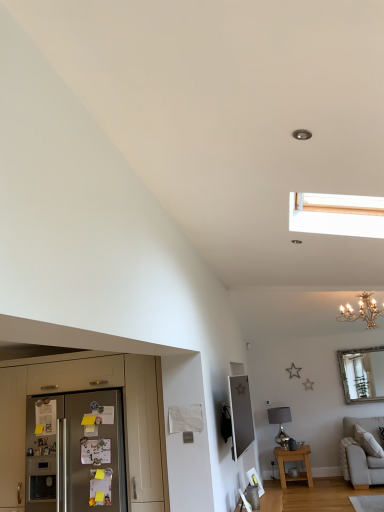
What do you see at coordinates (361, 454) in the screenshot? I see `light gray fabric couch at lower right` at bounding box center [361, 454].

What is the approximate height of stainless steel refrigerator at lower left?

1.58 meters.

Measure the distance between point (x=150, y=463) and camera.

3.73 meters.

Where is `silver metallic mirror at upper right`? The height and width of the screenshot is (512, 384). silver metallic mirror at upper right is located at coordinates (362, 374).

Locate an element on the screen. The image size is (384, 512). satin silver refrigerator at lower left is located at coordinates (75, 454).

In order to face satin silver refrigerator at lower left, should I rotate leftwards or rightwards?

Rotate left and turn 13.868 degrees.

You are a GUI agent. You are given a task and a screenshot of the screen. Output one action in this format:
    pyautogui.click(x=<x>, y=<y>)
    Task: Click on the beech wood side table at lower right
    Image resolution: width=384 pixels, height=512 pixels.
    Given the screenshot: What is the action you would take?
    pyautogui.click(x=294, y=462)

This screenshot has height=512, width=384. I want to click on light gray fabric couch at lower right, so click(361, 454).

From a real-world perspective, is satin silver lamp at lower right positioned above or below light gray fabric couch at lower right?

satin silver lamp at lower right is situated higher than light gray fabric couch at lower right in the real world.

In terms of size, does satin silver lamp at lower right appear bigger or smaller than light gray fabric couch at lower right?

Considering their sizes, satin silver lamp at lower right takes up less space than light gray fabric couch at lower right.

Can you see satin silver lamp at lower right touching light gray fabric couch at lower right?

No, satin silver lamp at lower right is not with light gray fabric couch at lower right.

Consider the image. Is satin silver lamp at lower right looking in the opposite direction of light gray fabric couch at lower right?

That's not correct — satin silver lamp at lower right is not looking away from light gray fabric couch at lower right.

Based on the photo, from the image's perspective, is satin silver lamp at lower right on top of beech wood side table at lower right?

Yes, from the image's perspective, satin silver lamp at lower right is on top of beech wood side table at lower right.

Is satin silver lamp at lower right facing towards beech wood side table at lower right?

No, satin silver lamp at lower right is not turned towards beech wood side table at lower right.

Considering the relative sizes of satin silver lamp at lower right and beech wood side table at lower right in the image provided, is satin silver lamp at lower right shorter than beech wood side table at lower right?

In fact, satin silver lamp at lower right may be taller than beech wood side table at lower right.

Which of these two, satin silver lamp at lower right or beech wood side table at lower right, is smaller?

satin silver lamp at lower right.

I want to click on cabinetry that is under the silver metallic mirror at upper right (from a real-world perspective), so click(88, 389).

From the image's perspective, is silver metallic mirror at upper right located above or below stainless steel refrigerator at lower left?

silver metallic mirror at upper right is situated lower than stainless steel refrigerator at lower left in the image.

Is silver metallic mirror at upper right wider or thinner than stainless steel refrigerator at lower left?

In the image, silver metallic mirror at upper right appears to be more narrow than stainless steel refrigerator at lower left.

Between silver metallic mirror at upper right and stainless steel refrigerator at lower left, which one appears on the left side from the viewer's perspective?

stainless steel refrigerator at lower left is more to the left.

From a real-world perspective, is light gray fabric couch at lower right below satin silver refrigerator at lower left?

Correct, in the physical world, light gray fabric couch at lower right is lower than satin silver refrigerator at lower left.

Where is `fridge above the light gray fabric couch at lower right (from a real-world perspective)`? The height and width of the screenshot is (512, 384). fridge above the light gray fabric couch at lower right (from a real-world perspective) is located at coordinates (75, 454).

Is light gray fabric couch at lower right oriented away from satin silver refrigerator at lower left?

No.

From the image's perspective, is light gray fabric couch at lower right positioned above or below satin silver refrigerator at lower left?

light gray fabric couch at lower right is below satin silver refrigerator at lower left.

Is the position of gold metallic chandelier at upper right less distant than that of stainless steel refrigerator at lower left?

No.

From the image's perspective, does gold metallic chandelier at upper right appear higher than stainless steel refrigerator at lower left?

Indeed, from the image's perspective, gold metallic chandelier at upper right is shown above stainless steel refrigerator at lower left.

Can you confirm if gold metallic chandelier at upper right is taller than stainless steel refrigerator at lower left?

Incorrect, the height of gold metallic chandelier at upper right is not larger of that of stainless steel refrigerator at lower left.

Can you tell me how much gold metallic chandelier at upper right and stainless steel refrigerator at lower left differ in facing direction?

The angle between the facing direction of gold metallic chandelier at upper right and the facing direction of stainless steel refrigerator at lower left is 0.787 degrees.

Is light gray fabric couch at lower right surrounded by satin silver refrigerator at lower left?

Actually, light gray fabric couch at lower right is outside satin silver refrigerator at lower left.

Relative to light gray fabric couch at lower right, is satin silver refrigerator at lower left in front or behind?

satin silver refrigerator at lower left is positioned closer to the viewer than light gray fabric couch at lower right.

From the image's perspective, which one is positioned lower, satin silver refrigerator at lower left or light gray fabric couch at lower right?

light gray fabric couch at lower right.

Does point (62, 399) come behind point (364, 426)?

No, it is in front of (364, 426).

Would you say light gray fabric couch at lower right contains stainless steel refrigerator at lower left?

No, stainless steel refrigerator at lower left is not inside light gray fabric couch at lower right.

Is light gray fabric couch at lower right wider than stainless steel refrigerator at lower left?

Correct, the width of light gray fabric couch at lower right exceeds that of stainless steel refrigerator at lower left.

This screenshot has width=384, height=512. Identify the location of lamp behind the light gray fabric couch at lower right. (x=280, y=423).

Image resolution: width=384 pixels, height=512 pixels. Find the location of `table below the satin silver lamp at lower right (from a real-world perspective)`. table below the satin silver lamp at lower right (from a real-world perspective) is located at coordinates (294, 462).

From the image, which object appears to be farther from stainless steel refrigerator at lower left, silver metallic mirror at upper right or gold metallic chandelier at upper right?

silver metallic mirror at upper right.

When comparing their distances from gold metallic chandelier at upper right, does beech wood side table at lower right or satin silver lamp at lower right seem further?

beech wood side table at lower right is further to gold metallic chandelier at upper right.

Considering their positions, is stainless steel refrigerator at lower left positioned closer to light gray fabric couch at lower right than satin silver lamp at lower right?

satin silver lamp at lower right lies closer to light gray fabric couch at lower right than the other object.

Looking at the image, which one is located further to gold metallic chandelier at upper right, silver metallic mirror at upper right or satin silver lamp at lower right?

Among the two, satin silver lamp at lower right is located further to gold metallic chandelier at upper right.

When comparing their distances from beech wood side table at lower right, does silver metallic mirror at upper right or light gray fabric couch at lower right seem further?

The object further to beech wood side table at lower right is silver metallic mirror at upper right.

Estimate the real-world distances between objects in this image. Which object is closer to beech wood side table at lower right, satin silver lamp at lower right or stainless steel refrigerator at lower left?

Based on the image, satin silver lamp at lower right appears to be nearer to beech wood side table at lower right.

Considering their positions, is gold metallic chandelier at upper right positioned further to stainless steel refrigerator at lower left than silver metallic mirror at upper right?

silver metallic mirror at upper right.

From the image, which object appears to be farther from light gray fabric couch at lower right, satin silver lamp at lower right or beech wood side table at lower right?

Among the two, satin silver lamp at lower right is located further to light gray fabric couch at lower right.

Where is `light fixture located between stainless steel refrigerator at lower left and light gray fabric couch at lower right in the left-right direction`? light fixture located between stainless steel refrigerator at lower left and light gray fabric couch at lower right in the left-right direction is located at coordinates (362, 311).

This screenshot has width=384, height=512. In order to click on mirror between gold metallic chandelier at upper right and light gray fabric couch at lower right in the up-down direction in this screenshot , I will do click(x=362, y=374).

Find the location of a particular element. Image resolution: width=384 pixels, height=512 pixels. fridge between stainless steel refrigerator at lower left and gold metallic chandelier at upper right in the horizontal direction is located at coordinates (75, 454).

Locate an element on the screen. The width and height of the screenshot is (384, 512). mirror that lies between gold metallic chandelier at upper right and satin silver lamp at lower right from top to bottom is located at coordinates (362, 374).